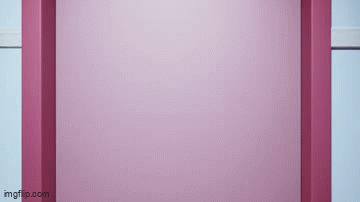
Find the location of a particular element. The height and width of the screenshot is (202, 360). book is located at coordinates (252, 153).